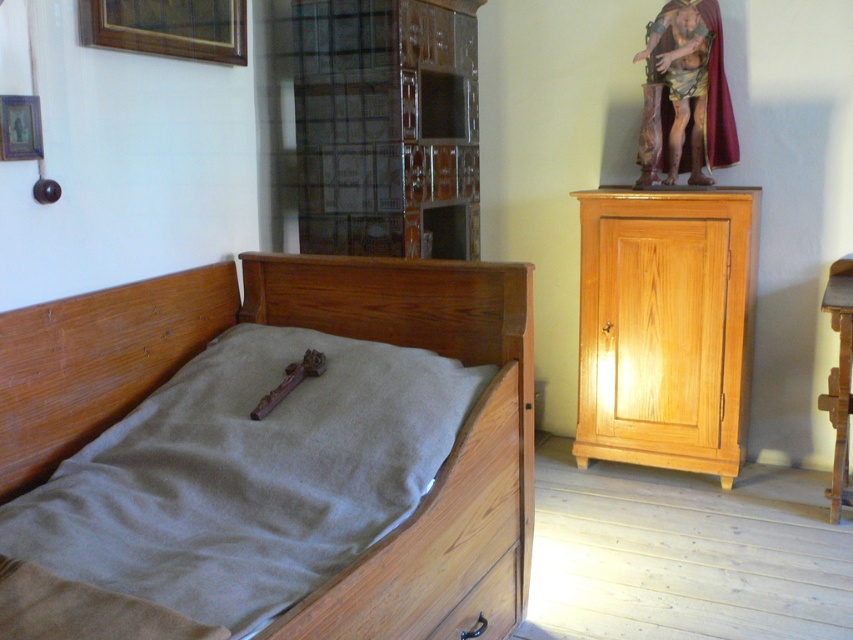
Question: Is wooden bed at left closer to camera compared to wooden crucifix at center?

Choices:
 (A) no
 (B) yes

Answer: (B)

Question: Which of the following is the closest to the observer?

Choices:
 (A) wooden drawer at lower center
 (B) wooden crucifix at center
 (C) wooden bed at left
 (D) light brown wood cabinet at right

Answer: (C)

Question: Which point is farther to the camera?

Choices:
 (A) (274, 397)
 (B) (463, 604)
 (C) (619, 236)
 (D) (42, 406)

Answer: (C)

Question: From the image, what is the correct spatial relationship of wooden bed at left in relation to wooden crucifix at center?

Choices:
 (A) right
 (B) left

Answer: (A)

Question: Can you confirm if wooden drawer at lower center is positioned below wooden crucifix at center?

Choices:
 (A) yes
 (B) no

Answer: (A)

Question: Among these points, which one is farthest from the camera?

Choices:
 (A) (265, 397)
 (B) (71, 346)
 (C) (659, 257)
 (D) (482, 593)

Answer: (C)